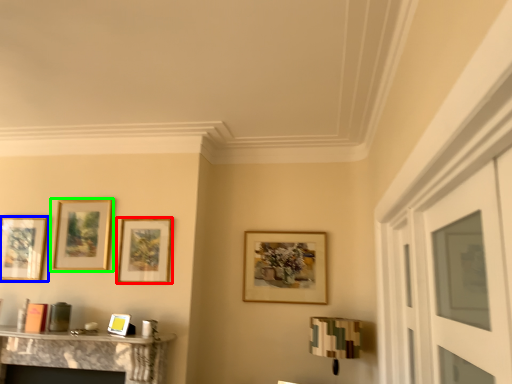
Question: Which object is the closest to the picture frame (highlighted by a red box)? Choose among these: picture frame (highlighted by a blue box) or picture frame (highlighted by a green box).

Choices:
 (A) picture frame
 (B) picture frame

Answer: (B)